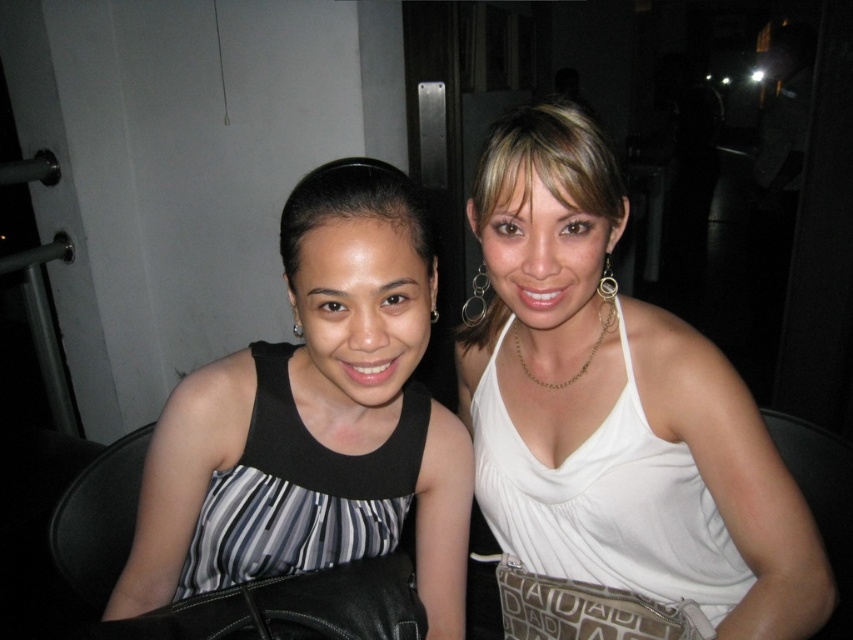
Question: Considering the relative positions of silver metallic earring at upper left and gold metallic hoop at upper center in the image provided, where is silver metallic earring at upper left located with respect to gold metallic hoop at upper center?

Choices:
 (A) above
 (B) below

Answer: (B)

Question: Which point appears closest to the camera in this image?

Choices:
 (A) (328, 204)
 (B) (437, 488)
 (C) (436, 317)
 (D) (299, 326)

Answer: (A)

Question: Which point appears closest to the camera in this image?

Choices:
 (A) (292, 326)
 (B) (815, 628)

Answer: (B)

Question: Which point appears farthest from the camera in this image?

Choices:
 (A) (757, 502)
 (B) (305, 465)
 (C) (434, 308)

Answer: (B)

Question: Is smooth black hair at center to the right of silver metallic earring at upper left from the viewer's perspective?

Choices:
 (A) no
 (B) yes

Answer: (B)

Question: Is black striped vest at left bigger than silver metallic earring at upper left?

Choices:
 (A) no
 (B) yes

Answer: (B)